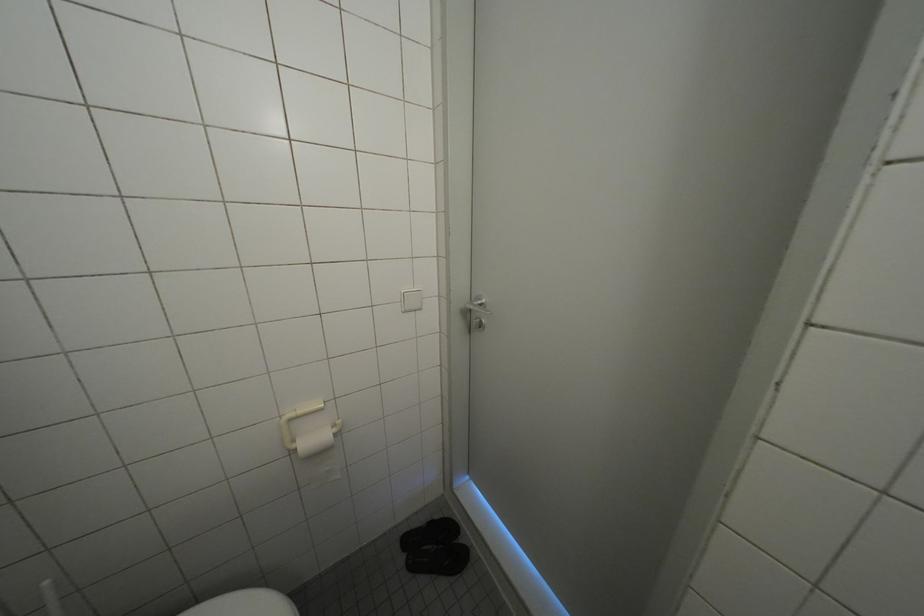
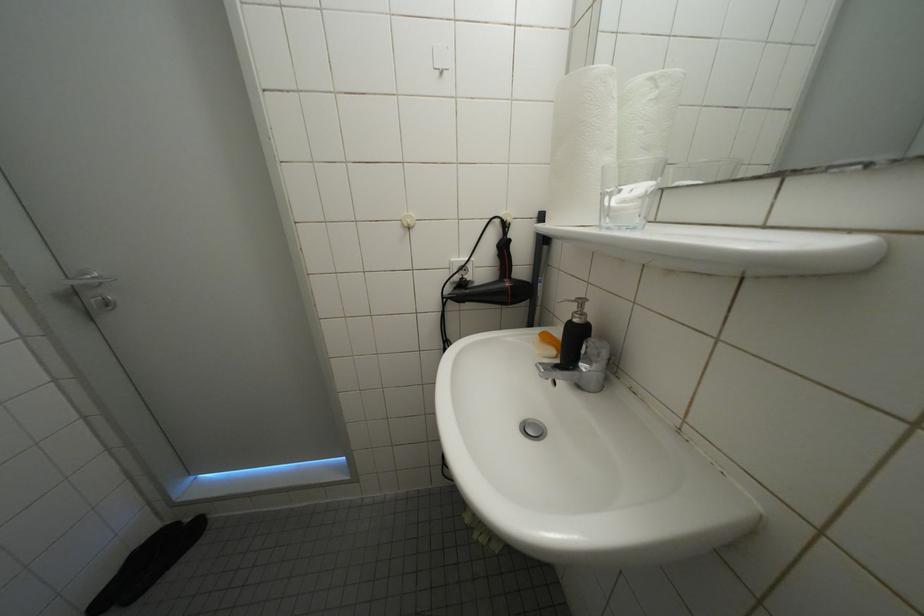
Question: The images are taken continuously from a first-person perspective. In which direction is your viewpoint rotating?

Choices:
 (A) Left
 (B) Right
 (C) Up
 (D) Down

Answer: (B)